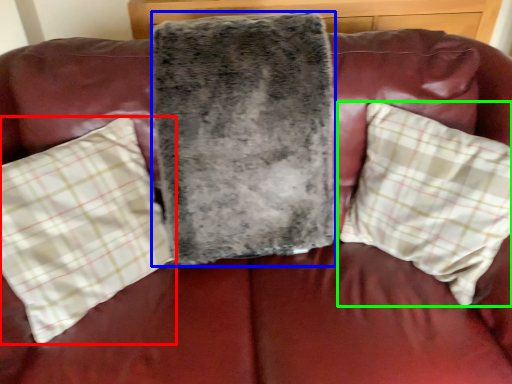
Question: Based on their relative distances, which object is nearer to pillow (highlighted by a red box)? Choose from blanket (highlighted by a blue box) and pillow (highlighted by a green box).

Choices:
 (A) blanket
 (B) pillow

Answer: (A)